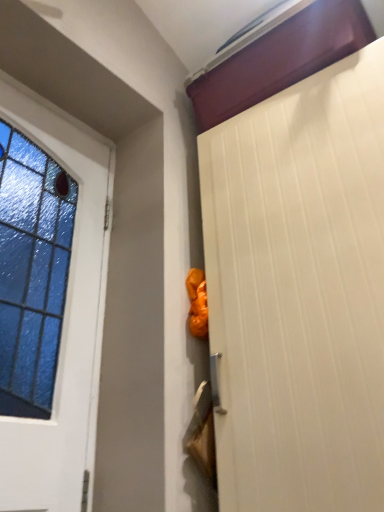
Question: Should I look upward or downward to see white textured door at upper right, the 1th door positioned from the right?

Choices:
 (A) down
 (B) up

Answer: (A)

Question: Is white glass door at left, marked as the 2th door in a right-to-left arrangement, turned away from white textured door at upper right, the 2th door positioned from the left?

Choices:
 (A) no
 (B) yes

Answer: (A)

Question: Is white glass door at left, the first door in the left-to-right sequence, located outside white textured door at upper right, the 1th door positioned from the right?

Choices:
 (A) no
 (B) yes

Answer: (B)

Question: Is white textured door at upper right, the 1th door positioned from the right, inside white glass door at left, the first door in the left-to-right sequence?

Choices:
 (A) no
 (B) yes

Answer: (A)

Question: From a real-world perspective, is white glass door at left, the first door in the left-to-right sequence, on white textured door at upper right, the 1th door positioned from the right?

Choices:
 (A) yes
 (B) no

Answer: (A)

Question: Could you tell me if white glass door at left, the first door in the left-to-right sequence, is turned towards white textured door at upper right, the 2th door positioned from the left?

Choices:
 (A) no
 (B) yes

Answer: (A)

Question: Is white glass door at left, the first door in the left-to-right sequence, wider than white textured door at upper right, the 1th door positioned from the right?

Choices:
 (A) yes
 (B) no

Answer: (B)

Question: Does white textured door at upper right, the 1th door positioned from the right, have a lesser width compared to white glass door at left, marked as the 2th door in a right-to-left arrangement?

Choices:
 (A) no
 (B) yes

Answer: (A)

Question: From a real-world perspective, is white textured door at upper right, the 2th door positioned from the left, under white glass door at left, marked as the 2th door in a right-to-left arrangement?

Choices:
 (A) yes
 (B) no

Answer: (A)

Question: Is the depth of white textured door at upper right, the 1th door positioned from the right, less than that of white glass door at left, marked as the 2th door in a right-to-left arrangement?

Choices:
 (A) yes
 (B) no

Answer: (A)

Question: From the image's perspective, would you say white textured door at upper right, the 1th door positioned from the right, is positioned over white glass door at left, the first door in the left-to-right sequence?

Choices:
 (A) no
 (B) yes

Answer: (A)

Question: Is white textured door at upper right, the 2th door positioned from the left, oriented towards white glass door at left, the first door in the left-to-right sequence?

Choices:
 (A) yes
 (B) no

Answer: (B)

Question: Considering the relative sizes of white textured door at upper right, the 2th door positioned from the left, and white glass door at left, marked as the 2th door in a right-to-left arrangement, in the image provided, is white textured door at upper right, the 2th door positioned from the left, smaller than white glass door at left, marked as the 2th door in a right-to-left arrangement,?

Choices:
 (A) yes
 (B) no

Answer: (B)

Question: From their relative heights in the image, would you say white textured door at upper right, the 2th door positioned from the left, is taller or shorter than white glass door at left, marked as the 2th door in a right-to-left arrangement?

Choices:
 (A) tall
 (B) short

Answer: (A)